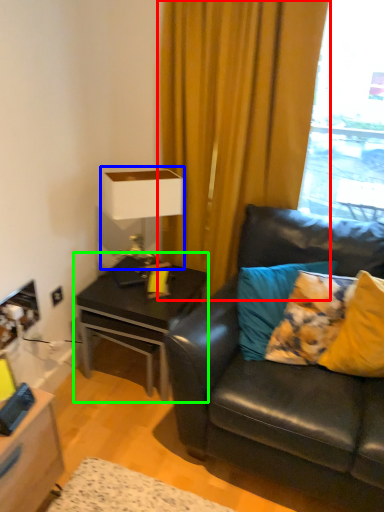
Question: Which object is positioned farthest from curtain (highlighted by a red box)? Select from table lamp (highlighted by a blue box) and table (highlighted by a green box).

Choices:
 (A) table lamp
 (B) table

Answer: (B)